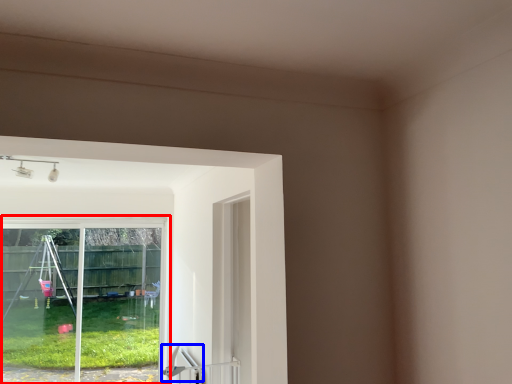
Question: Among these objects, which one is nearest to the camera, window (highlighted by a red box) or door handle (highlighted by a blue box)?

Choices:
 (A) window
 (B) door handle

Answer: (B)